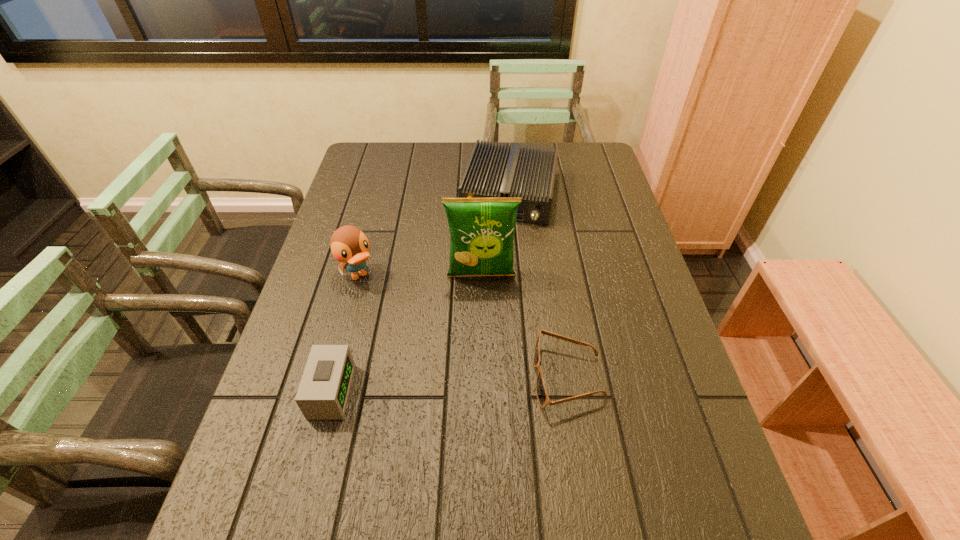
The image size is (960, 540). I want to click on vacant space located 0.290m on the back panel of the farthest object, so click(486, 297).

Where is `vacant area situated 0.060m on the back panel of the farthest object`? This screenshot has height=540, width=960. vacant area situated 0.060m on the back panel of the farthest object is located at coordinates (499, 240).

Image resolution: width=960 pixels, height=540 pixels. Find the location of `free space located on the back panel of the farthest object`. free space located on the back panel of the farthest object is located at coordinates (480, 323).

The width and height of the screenshot is (960, 540). Find the location of `vacant space located 0.230m on the front-facing side of the duck`. vacant space located 0.230m on the front-facing side of the duck is located at coordinates (413, 344).

Find the location of a particular element. Image resolution: width=960 pixels, height=540 pixels. vacant space located on the front-facing side of the duck is located at coordinates coord(453,395).

Locate an element on the screen. This screenshot has width=960, height=540. vacant region located 0.200m on the front-facing side of the duck is located at coordinates (406, 336).

Locate an element on the screen. This screenshot has width=960, height=540. vacant space positioned on the front-facing side of the tallest object is located at coordinates (484, 365).

Identify the location of vacant area situated 0.080m on the front-facing side of the tallest object. This screenshot has width=960, height=540. (483, 308).

Where is `blank space located 0.250m on the front-facing side of the tallest object`? blank space located 0.250m on the front-facing side of the tallest object is located at coordinates (484, 365).

Identify the location of object present at the far edge. (x=493, y=171).